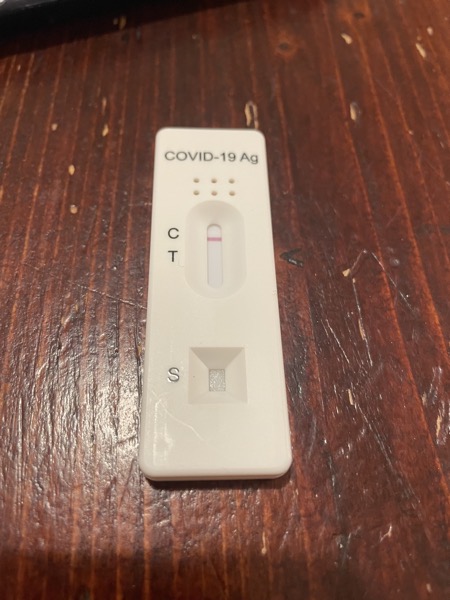
I want to click on grain lines in wood table, so click(364, 415), click(93, 427), click(73, 415), click(49, 375), click(304, 351), click(337, 493).